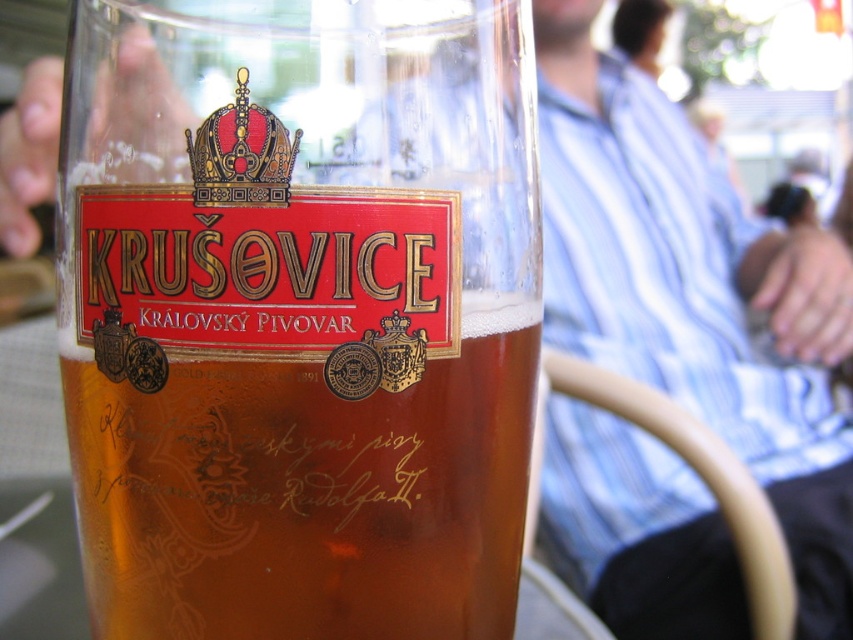
Question: Is translucent glass beer at center behind gold metallic crown at upper center?

Choices:
 (A) yes
 (B) no

Answer: (B)

Question: Among these points, which one is farthest from the camera?

Choices:
 (A) (242, 104)
 (B) (477, 429)

Answer: (B)

Question: Is translucent glass beer at center smaller than gold metallic crown at upper center?

Choices:
 (A) no
 (B) yes

Answer: (A)

Question: Which point is farther to the camera?

Choices:
 (A) translucent glass beer at center
 (B) gold metallic crown at upper center

Answer: (B)

Question: Observing the image, what is the correct spatial positioning of translucent glass beer at center in reference to gold metallic crown at upper center?

Choices:
 (A) left
 (B) right

Answer: (B)